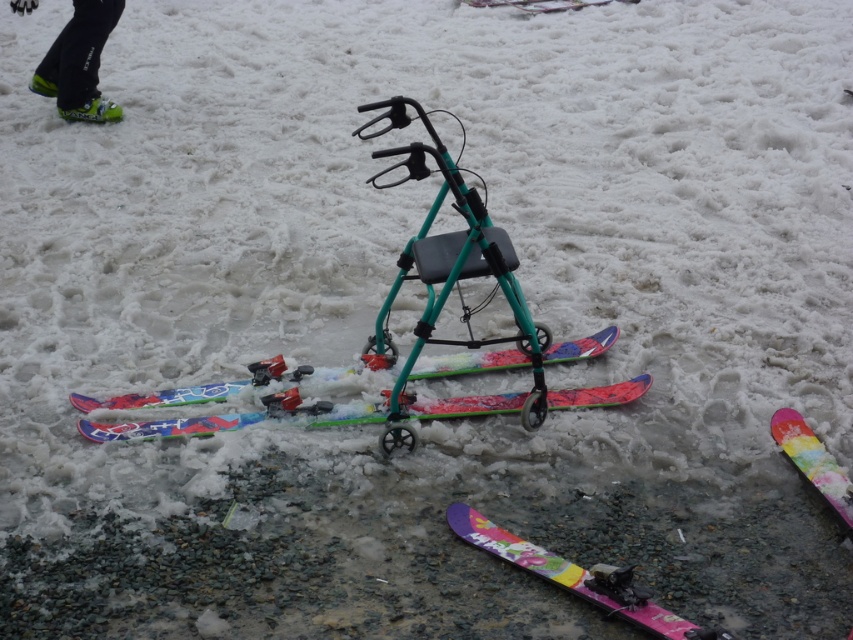
Is multicolored plastic skis at center positioned in front of green matte ski boot at upper left?

Yes, it is in front of green matte ski boot at upper left.

Can you confirm if multicolored plastic skis at center is wider than green matte ski boot at upper left?

Correct, the width of multicolored plastic skis at center exceeds that of green matte ski boot at upper left.

Locate an element on the screen. This screenshot has width=853, height=640. multicolored plastic skis at center is located at coordinates (231, 420).

This screenshot has height=640, width=853. In order to click on multicolored plastic skis at center in this screenshot , I will do `click(231, 420)`.

Measure the distance between green matte ski boot at upper left and rainbow plastic ski at lower right.

16.11 feet

Is green matte ski boot at upper left taller than rainbow plastic ski at lower right?

Correct, green matte ski boot at upper left is much taller as rainbow plastic ski at lower right.

Image resolution: width=853 pixels, height=640 pixels. Describe the element at coordinates (79, 61) in the screenshot. I see `green matte ski boot at upper left` at that location.

The height and width of the screenshot is (640, 853). Identify the location of green matte ski boot at upper left. (79, 61).

Does multicolored plastic ski at center have a lesser height compared to rainbow plastic ski at lower right?

Yes, multicolored plastic ski at center is shorter than rainbow plastic ski at lower right.

Is point (445, 412) more distant than point (834, 486)?

Yes.

Between point (639, 387) and point (795, 449), which one is positioned behind?

The point (639, 387) is behind.

Identify the location of multicolored plastic ski at center. (469, 404).